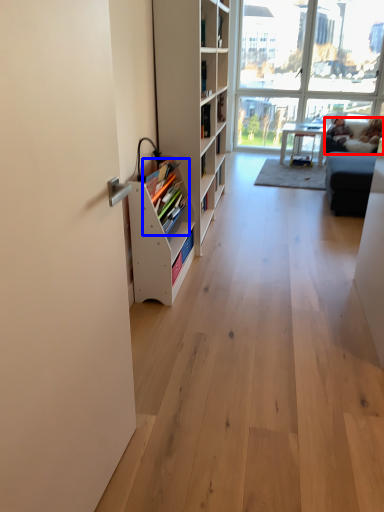
Question: Which point is closer to the camera, couch (highlighted by a red box) or book (highlighted by a blue box)?

Choices:
 (A) couch
 (B) book

Answer: (B)